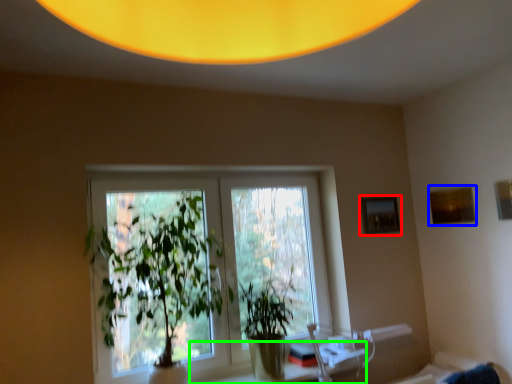
Question: Which object is positioned farthest from picture frame (highlighted by a red box)? Select from picture frame (highlighted by a blue box) and table (highlighted by a green box).

Choices:
 (A) picture frame
 (B) table

Answer: (B)